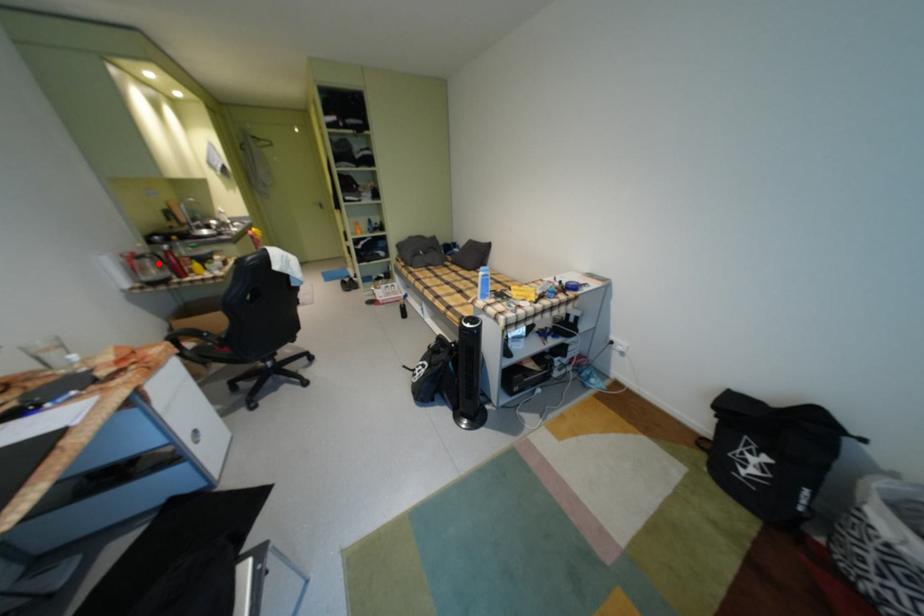
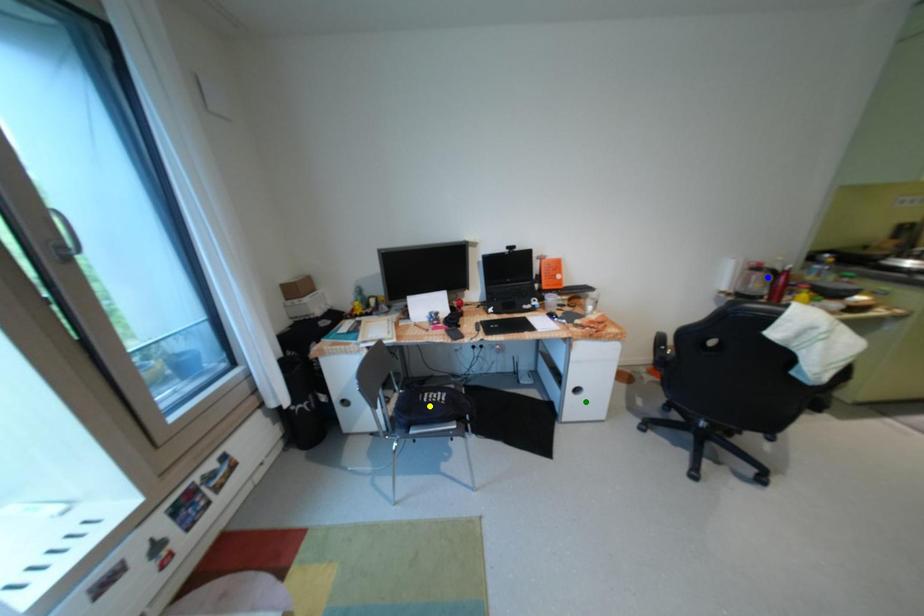
Question: I am providing you with two images of the same scene from different viewpoints. A red point is marked on the first image. You are given multiple points on the second image. Which point in image 2 is actually the same real-world point as the red point in image 1?

Choices:
 (A) blue point
 (B) yellow point
 (C) green point

Answer: (A)